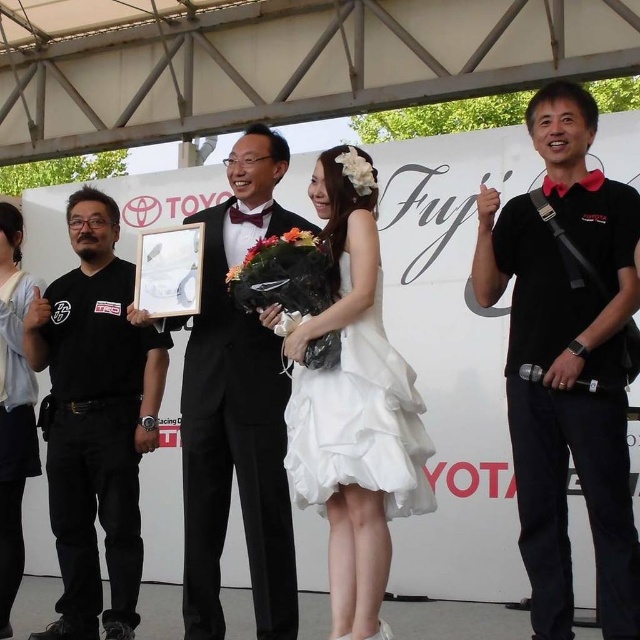
From the picture: You are a photographer at the event and need to place a small decoration exactly at the center of the stage. The white silk flower at center is currently at coordinates point 0.428, 0.367. Is the flower already at the center?

The white silk flower at center is located at point [234,273], so it is already positioned at the center of the stage.

You are standing at the event and want to take a photo of both the point at (618,342) and the point at (348,332). Which point will appear closer to the camera in your photo?

Point (618,342) is further to the camera than point (348,332), so the point at (348,332) will appear closer to the camera in the photo.

You are a photographer at the event and need to capture a photo of the black matte shirt at right and the white satin dress at center. Based on their positions, which one is more to the right?

The black matte shirt at right is more to the right than the white satin dress at center.